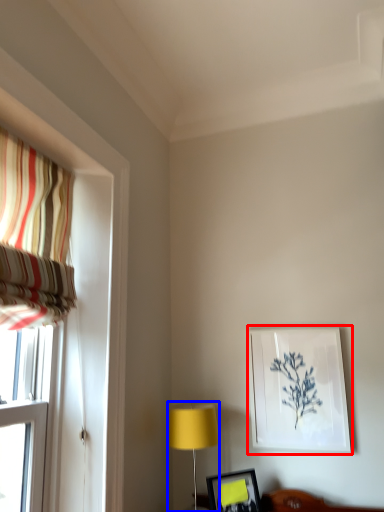
Question: Which of the following is the farthest to the observer, picture frame (highlighted by a red box) or table lamp (highlighted by a blue box)?

Choices:
 (A) picture frame
 (B) table lamp

Answer: (A)